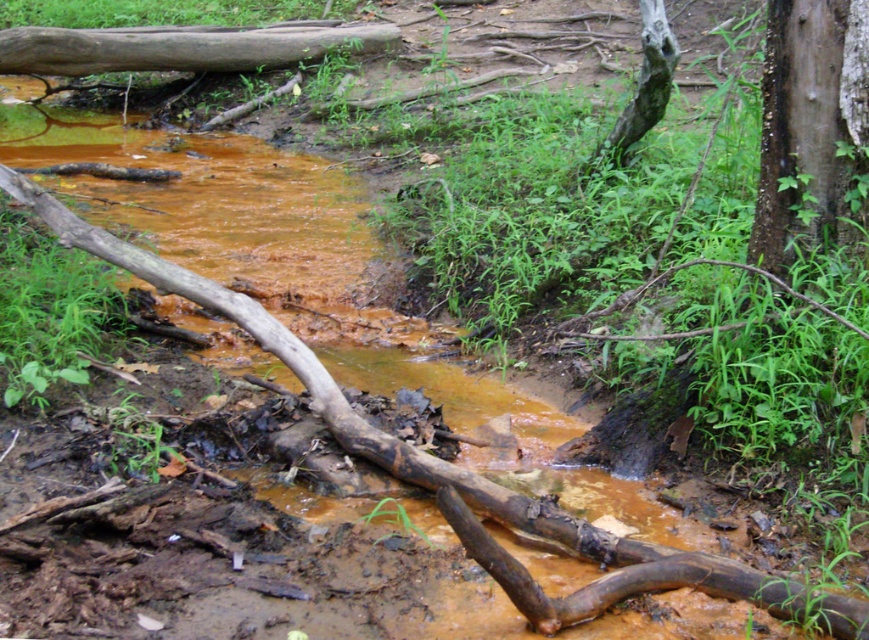
Question: Is green rough bark tree trunk at upper right further to camera compared to brown rough log at upper left?

Choices:
 (A) no
 (B) yes

Answer: (A)

Question: Which point is farther from the camera taking this photo?

Choices:
 (A) (263, 49)
 (B) (598, 150)

Answer: (A)

Question: Which point is farther from the camera taking this photo?

Choices:
 (A) (251, 35)
 (B) (653, 88)
 (C) (795, 83)

Answer: (A)

Question: Does green rough bark tree trunk at upper right lie in front of brown rough log at upper left?

Choices:
 (A) no
 (B) yes

Answer: (B)

Question: Does green rough bark tree trunk at upper right appear over gray rough tree trunk at upper right?

Choices:
 (A) yes
 (B) no

Answer: (B)

Question: Which object is closer to the camera taking this photo?

Choices:
 (A) green rough bark tree trunk at upper right
 (B) brown rough log at upper left

Answer: (A)